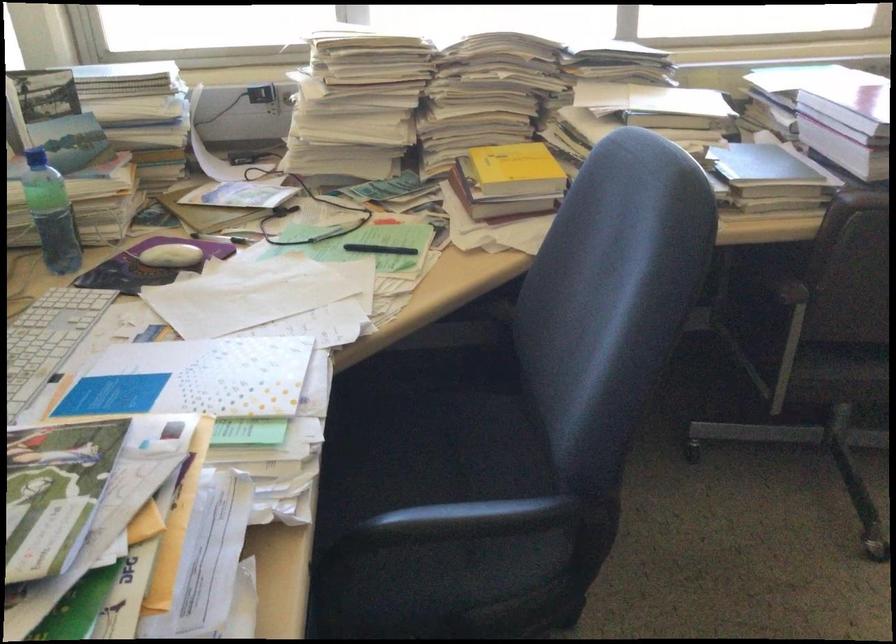
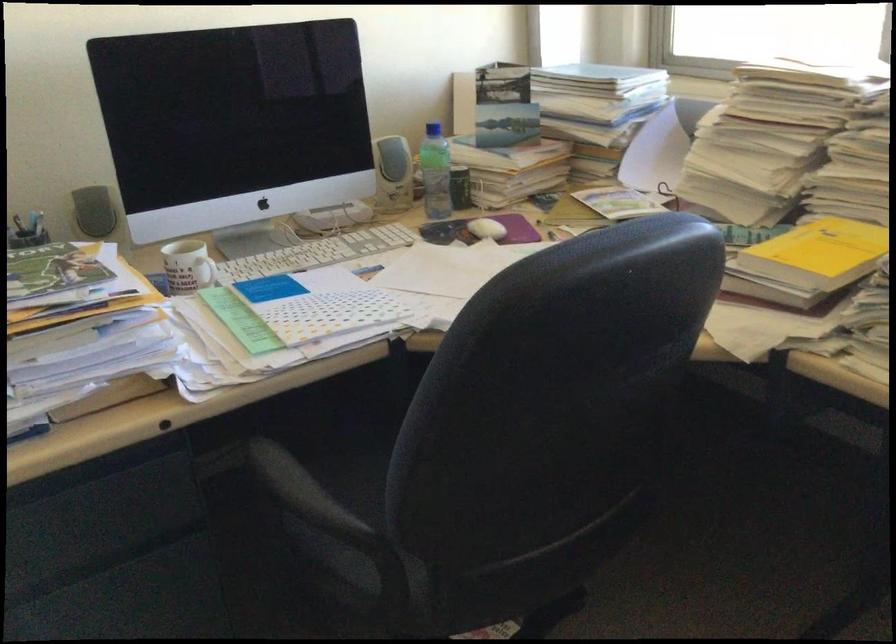
The point at (558, 522) is marked in the first image. Where is the corresponding point in the second image?

(314, 521)